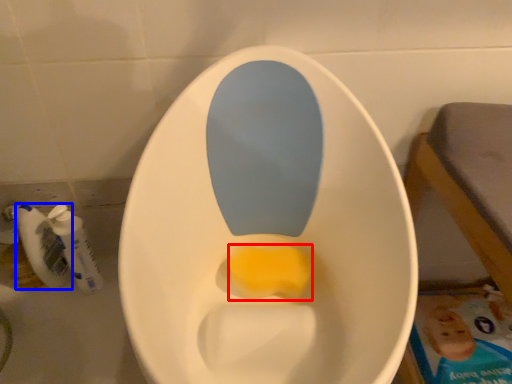
Question: Which point is further to the camera, food (highlighted by a red box) or mouthwash (highlighted by a blue box)?

Choices:
 (A) food
 (B) mouthwash

Answer: (B)